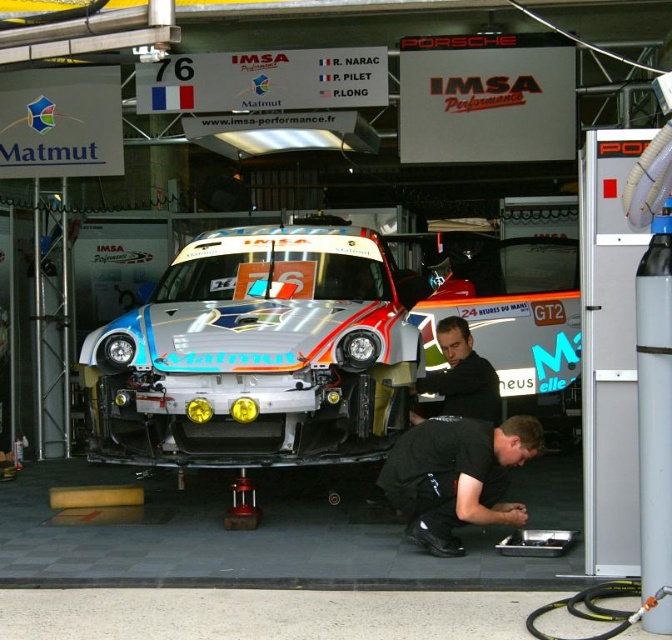
Between silver metallic car at center and black fabric shirt at center, which one is positioned higher?

silver metallic car at center is higher up.

From the picture: Is silver metallic car at center below black fabric shirt at center?

Actually, silver metallic car at center is above black fabric shirt at center.

Is point (310, 419) less distant than point (489, 404)?

Yes, it is.

The height and width of the screenshot is (640, 672). I want to click on silver metallic car at center, so click(317, 340).

Looking at this image, which is more to the right, black fabric squat at lower center or black fabric shirt at center?

Positioned to the right is black fabric shirt at center.

Is black fabric squat at lower center taller than black fabric shirt at center?

Yes, black fabric squat at lower center is taller than black fabric shirt at center.

What do you see at coordinates (456, 476) in the screenshot? This screenshot has width=672, height=640. I see `black fabric squat at lower center` at bounding box center [456, 476].

Where is `black fabric squat at lower center`? black fabric squat at lower center is located at coordinates (456, 476).

Does point (325, 225) come behind point (427, 419)?

Yes, it is.

Who is taller, silver metallic car at center or black fabric squat at lower center?

silver metallic car at center

What do you see at coordinates (317, 340) in the screenshot? I see `silver metallic car at center` at bounding box center [317, 340].

The height and width of the screenshot is (640, 672). I want to click on silver metallic car at center, so click(317, 340).